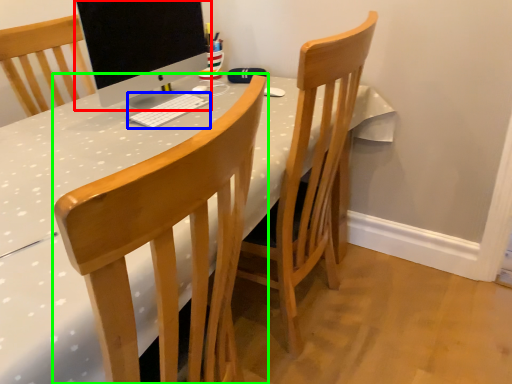
Question: Which is farther away from computer monitor (highlighted by a red box)? computer keyboard (highlighted by a blue box) or chair (highlighted by a green box)?

Choices:
 (A) computer keyboard
 (B) chair

Answer: (B)